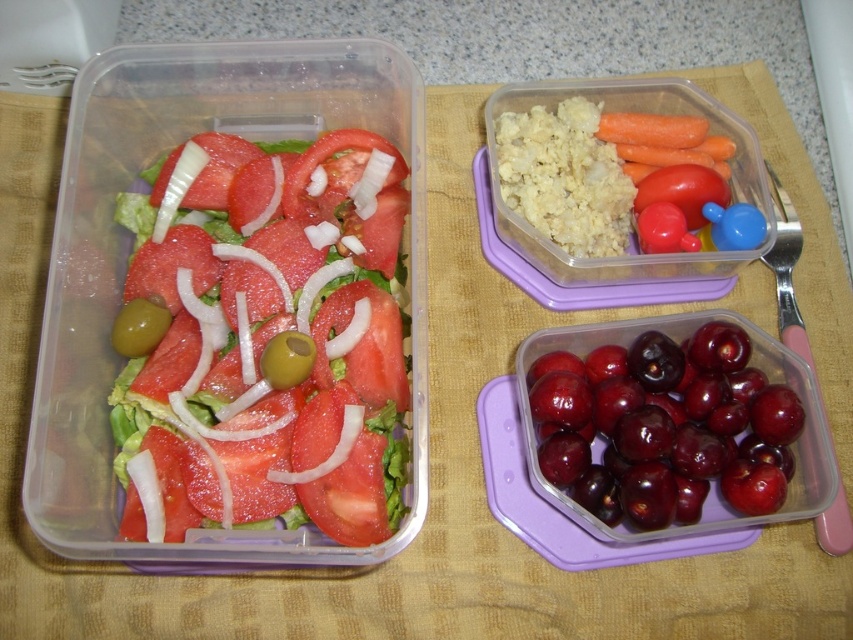
Looking at this image, who is positioned more to the left, shiny red cherries at lower right or green matte olive at center?

green matte olive at center

This screenshot has height=640, width=853. What are the coordinates of `shiny red cherries at lower right` in the screenshot? It's located at (653, 413).

Is sliced tomato salad at center closer to the viewer compared to green matte olive at left?

Answer: Yes.

Identify the location of sliced tomato salad at center. (267, 340).

Who is more forward, (x=137, y=307) or (x=271, y=340)?

Point (x=271, y=340) is in front.

Which is in front, point (155, 332) or point (283, 342)?

Point (283, 342) is more forward.

Identify the location of green matte olive at left. (138, 326).